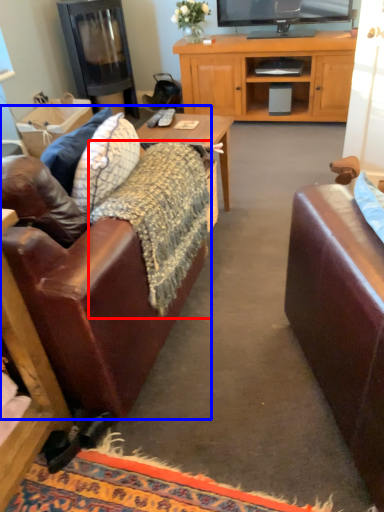
Question: Which point is further to the camera, blanket (highlighted by a red box) or studio couch (highlighted by a blue box)?

Choices:
 (A) blanket
 (B) studio couch

Answer: (A)